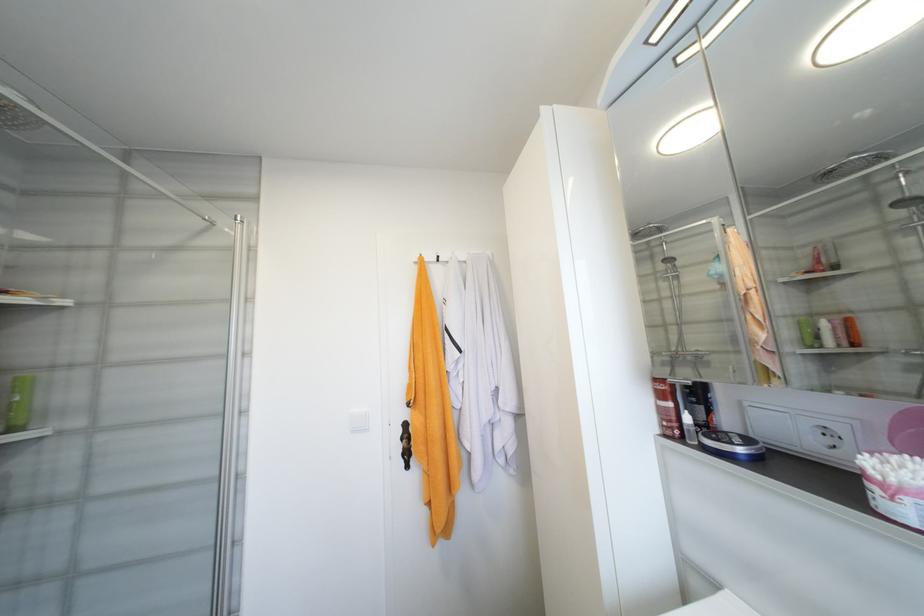
Which object does [688,427] point to?

This point indicates the white dropper bottle.